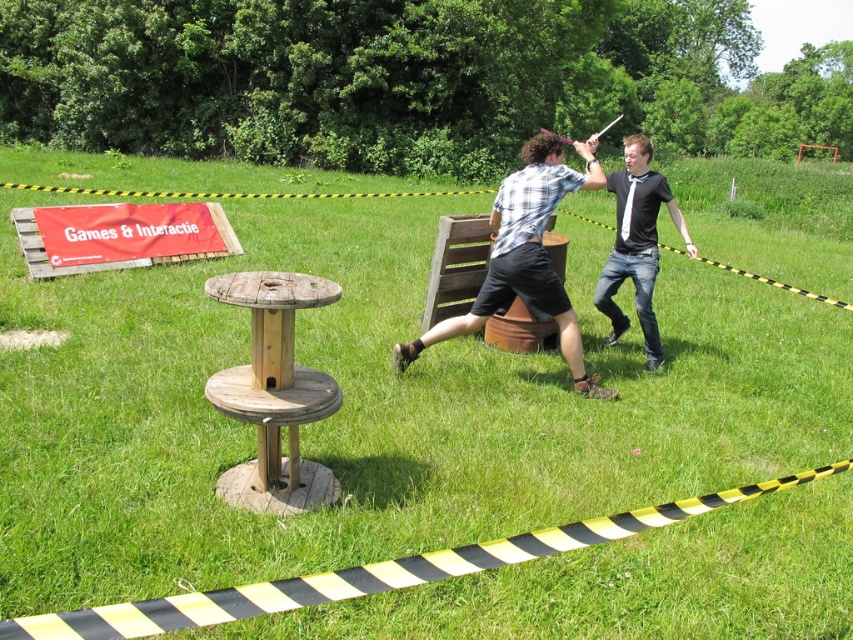
You are standing at the entrance of the event area marked by the black and yellow barrier tape. You want to find the plaid shirt at center. According to the scene, where should you look relative to the wooden structure on the left?

The plaid shirt at center is located at point (526, 256), which is to the right of the wooden structure on the left. So you should look towards the center area, to the right side of the wooden structure.

You are a photographer who wants to capture a closeup shot of the plaid shirt at center. Your camera is set to a focal length of 50mm. Given that the minimum focusing distance for this camera is 1 meter, can you take the photo without moving closer than 5.40 meters?

The plaid shirt at center and camera are 5.40 meters apart. Since the minimum focusing distance is 1 meter, you can take the photo at 5.40 meters because it is beyond the minimum required distance.